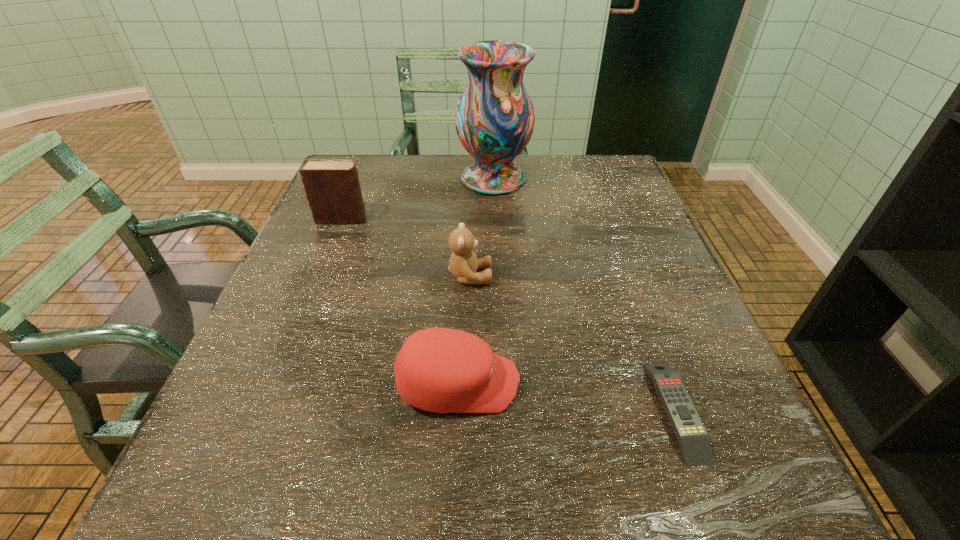
Where is `free space located on the spine side of the leftmost object`? Image resolution: width=960 pixels, height=540 pixels. free space located on the spine side of the leftmost object is located at coordinates (480, 219).

I want to click on free spot located 0.150m on the face of the third farthest object, so click(x=565, y=276).

Locate an element on the screen. Image resolution: width=960 pixels, height=540 pixels. vacant space located 0.260m on the front-facing side of the cap is located at coordinates (681, 383).

Locate an element on the screen. The height and width of the screenshot is (540, 960). vacant space located on the left of the shortest object is located at coordinates (520, 410).

Identify the location of object located at the far edge. pos(494,119).

What are the coordinates of `object present at the near edge` in the screenshot? It's located at (692, 437).

In order to click on object at the left edge in this screenshot , I will do `click(332, 187)`.

Find the location of `object at the right edge`. object at the right edge is located at coordinates (692, 437).

Where is `object that is at the near right corner`? object that is at the near right corner is located at coordinates (692, 437).

At what (x,y) coordinates should I click in order to perform the action: click on vacant area at the far edge of the desktop. Please return your answer as a coordinate pair (x, y). This screenshot has width=960, height=540. Looking at the image, I should click on (535, 193).